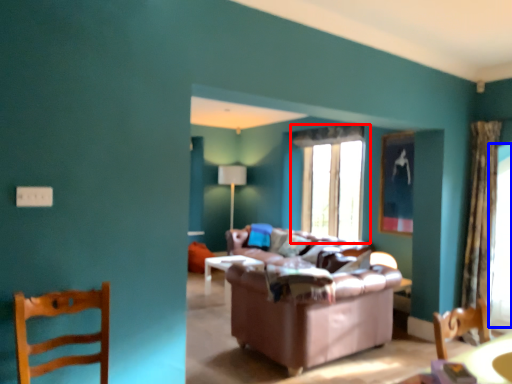
Question: Which object is closer to the camera taking this photo, window (highlighted by a red box) or window screen (highlighted by a blue box)?

Choices:
 (A) window
 (B) window screen

Answer: (B)